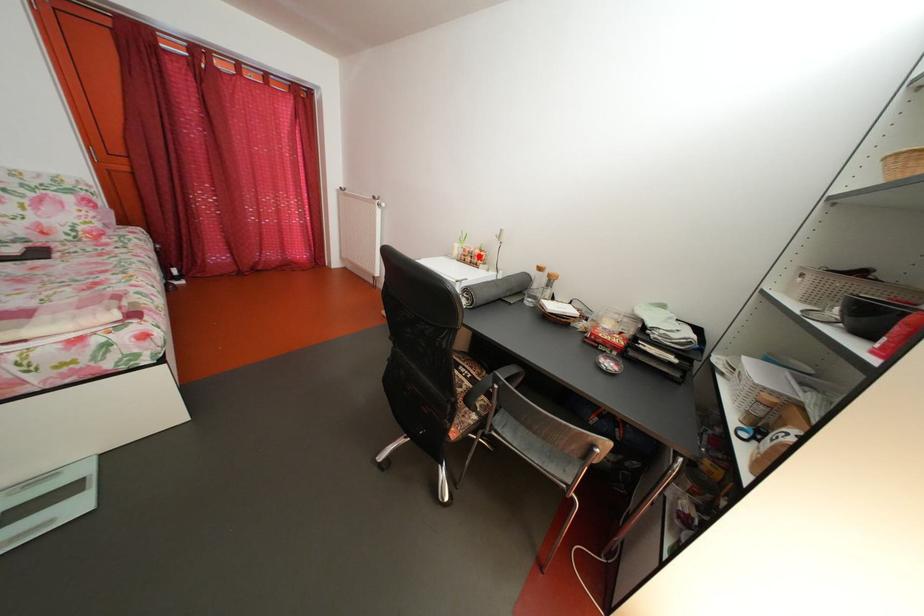
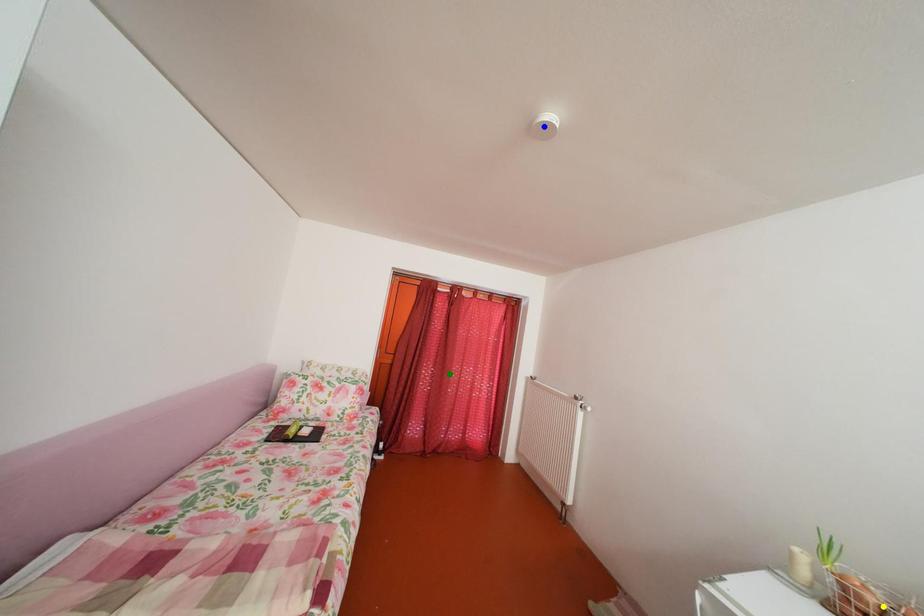
Question: I am providing you with two images of the same scene from different viewpoints. A red point is marked on the first image. You are given multiple points on the second image. In image 2, which mark is for the same physical point as the one in image 1?

Choices:
 (A) green point
 (B) yellow point
 (C) blue point

Answer: (B)